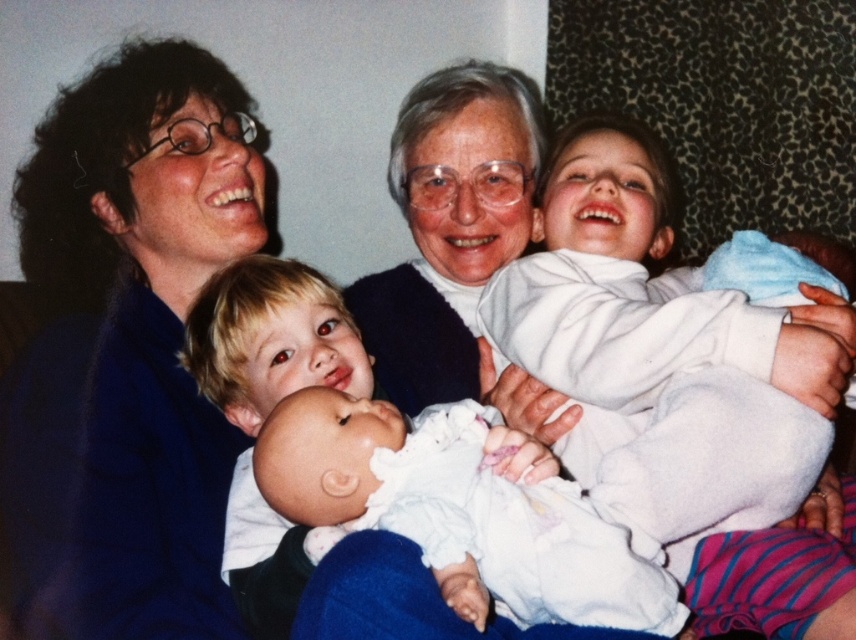
Based on the photo, you are a photographer setting up a camera in the living room. You notice the matte blue sweater at upper left and the white soft cloth at upper right. Which object is wider from the camera perspective?

The matte blue sweater at upper left is wider than the white soft cloth at upper right according to the description.